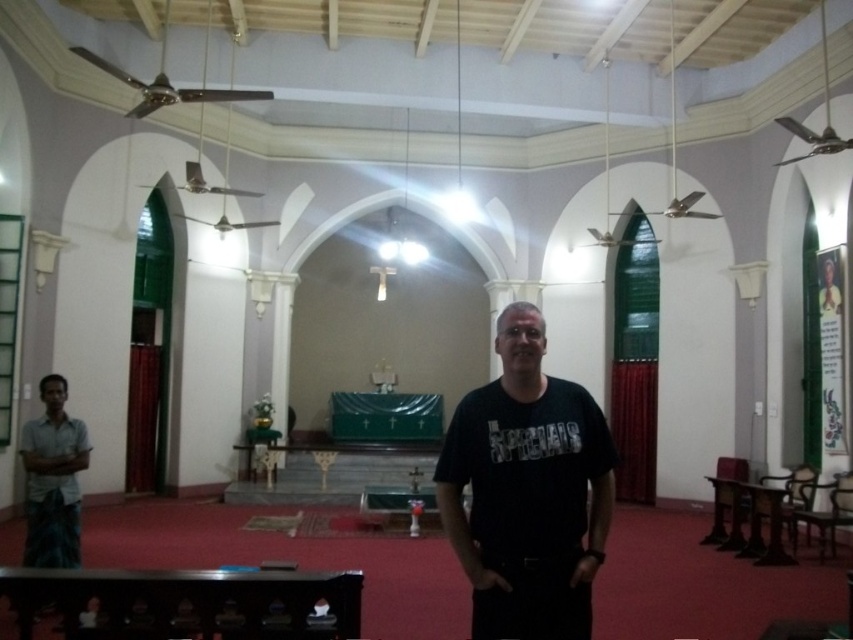
You are standing at the entrance of the church and want to take a photo of both point (461, 461) and point (49, 496). Which point will appear larger in your photo?

Point (461, 461) is closer to the camera than point (49, 496), so it will appear larger in the photo.